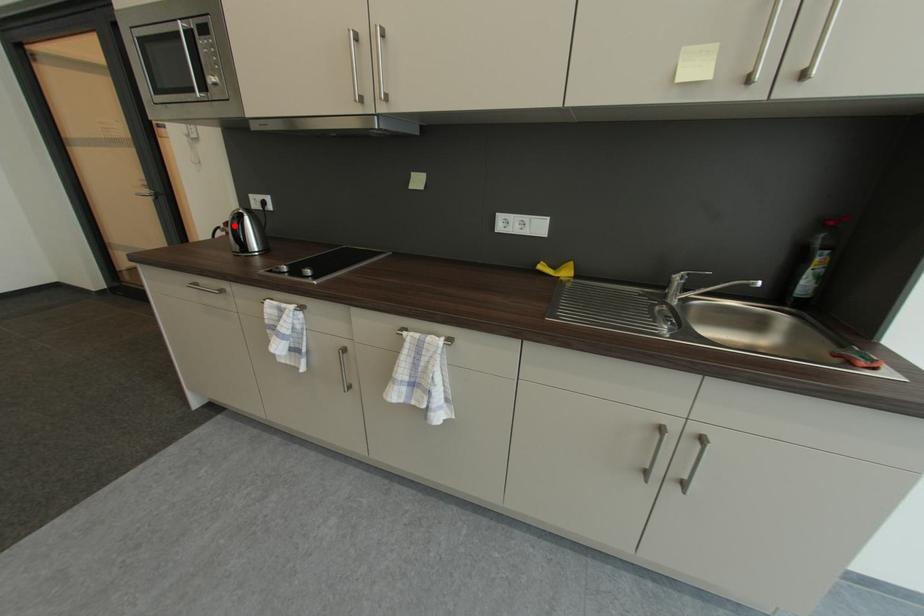
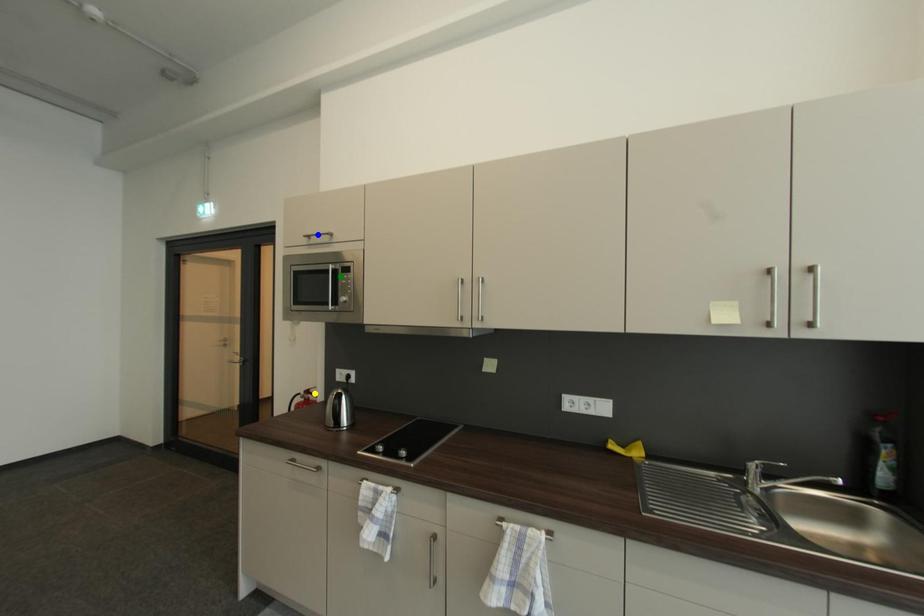
Question: I am providing you with two images of the same scene from different viewpoints. A red point is marked on the first image. You are given multiple points on the second image. Can you choose the point in image 2 that corresponds to the point in image 1?

Choices:
 (A) blue point
 (B) yellow point
 (C) green point

Answer: (B)